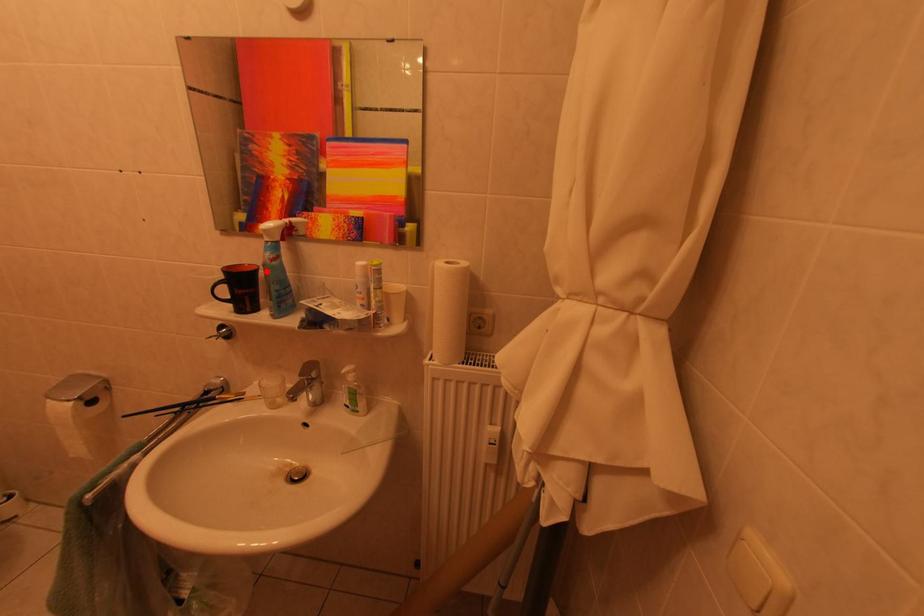
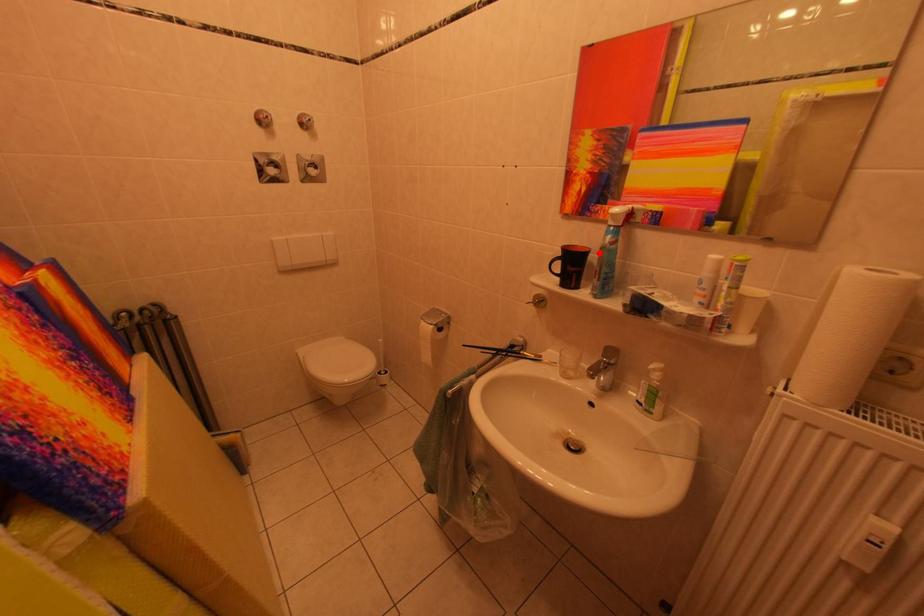
I am providing you with two images of the same scene from different viewpoints. A red point is marked on the first image and another point is marked on the second image. Are the points marked in image1 and image2 representing the same 3D position?

Yes